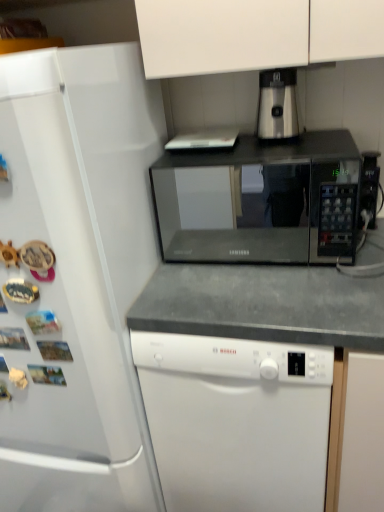
The image size is (384, 512). I want to click on free space in front of black matte microwave at center, so click(x=264, y=294).